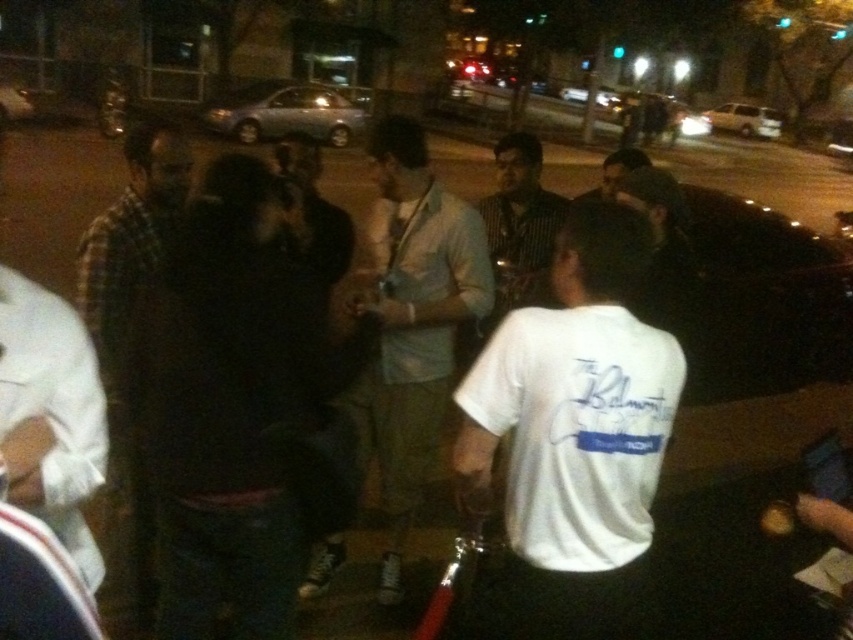
Between plaid fabric shirt at left and striped shirt at center, which one appears on the left side from the viewer's perspective?

plaid fabric shirt at left is more to the left.

Is the position of plaid fabric shirt at left more distant than that of striped shirt at center?

No, plaid fabric shirt at left is in front of striped shirt at center.

The width and height of the screenshot is (853, 640). In order to click on plaid fabric shirt at left in this screenshot , I will do [x=131, y=340].

Is point (412, 480) less distant than point (154, 161)?

No, (412, 480) is behind (154, 161).

From the picture: Is light blue cotton shirt at center to the right of plaid fabric shirt at left from the viewer's perspective?

Correct, you'll find light blue cotton shirt at center to the right of plaid fabric shirt at left.

Find the location of `light blue cotton shirt at center`. light blue cotton shirt at center is located at coordinates (412, 323).

Which is above, white cotton t-shirt at center or plaid fabric shirt at left?

plaid fabric shirt at left is above.

Does white cotton t-shirt at center appear on the right side of plaid fabric shirt at left?

Indeed, white cotton t-shirt at center is positioned on the right side of plaid fabric shirt at left.

Does point (589, 333) come closer to viewer compared to point (113, 310)?

Yes.

I want to click on white cotton t-shirt at center, so click(x=573, y=433).